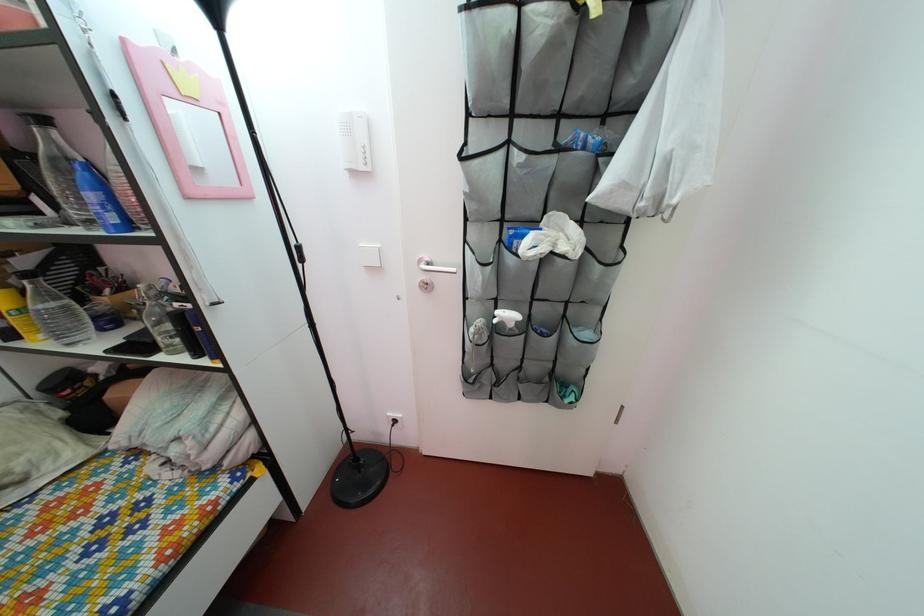
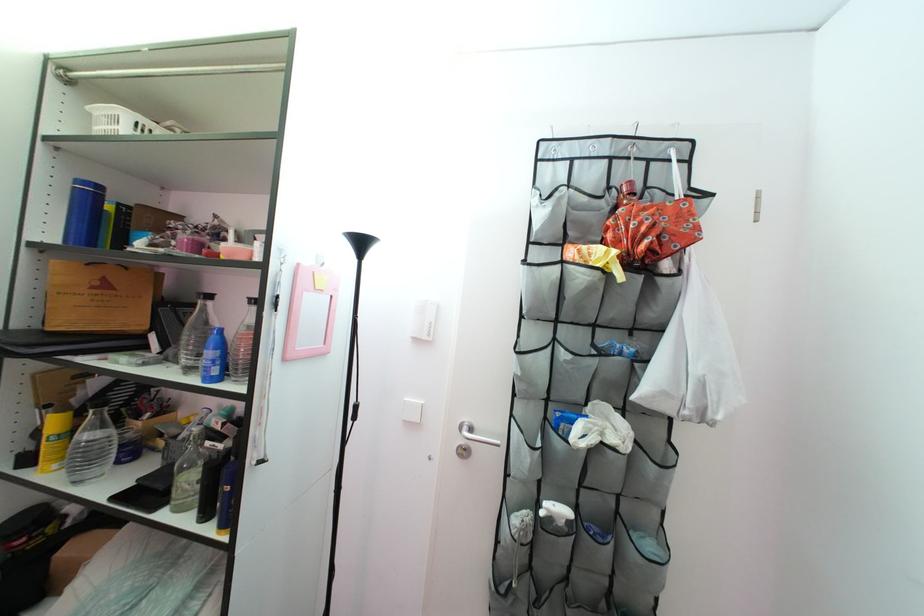
In a continuous first-person perspective shot, in which direction is the camera moving?

The cameraman walked toward left, backward.